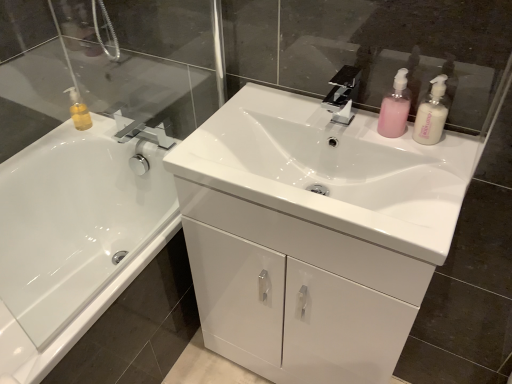
This screenshot has width=512, height=384. Identify the location of vacant region to the left of pink plastic pump bottle at upper right, which ranks as the first toiletry in front-to-back order. (362, 132).